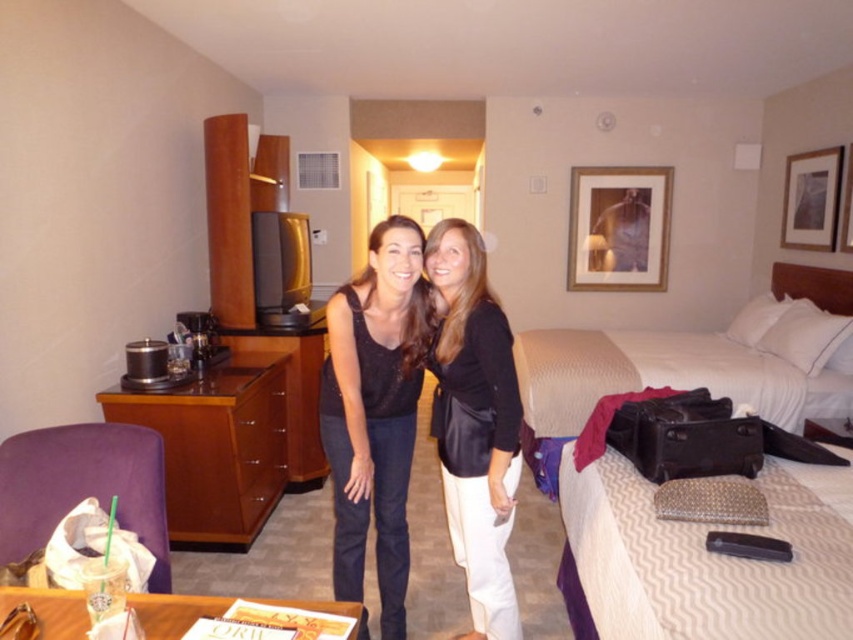
You are packing for a trip and have limited space in your suitcase. You need to decide which item between the matte black tank top at center and the black leather jacket at center takes up more space. Which one should you consider packing first?

The matte black tank top at center might be wider than black leather jacket at center, so it could take up more space. You should consider packing the black leather jacket at center first to save space.

From the picture: You are a hotel housekeeper who needs to store the black leather jacket at center and the white textured bed at center. Given their sizes, which item requires more storage space?

The black leather jacket at center requires more storage space because it is larger in size than the white textured bed at center.